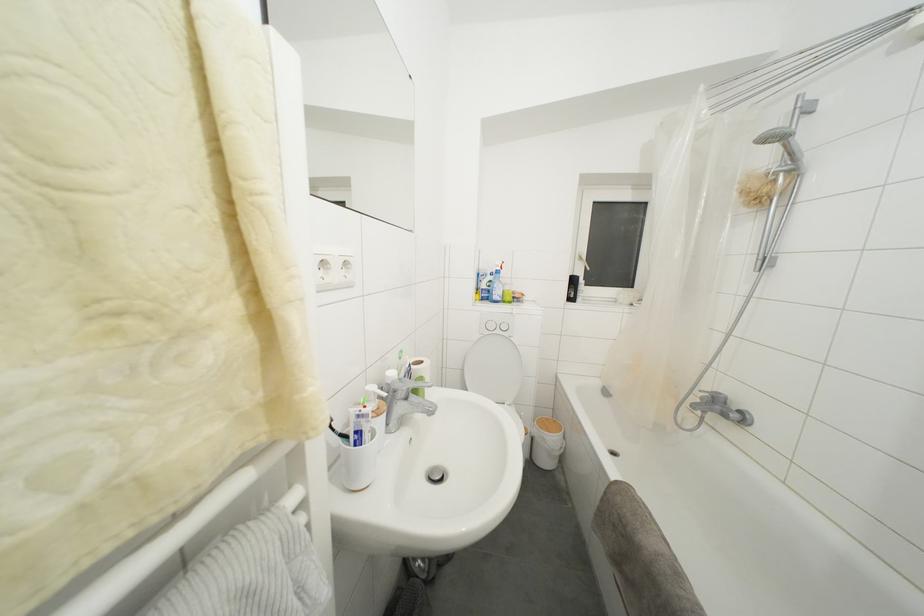
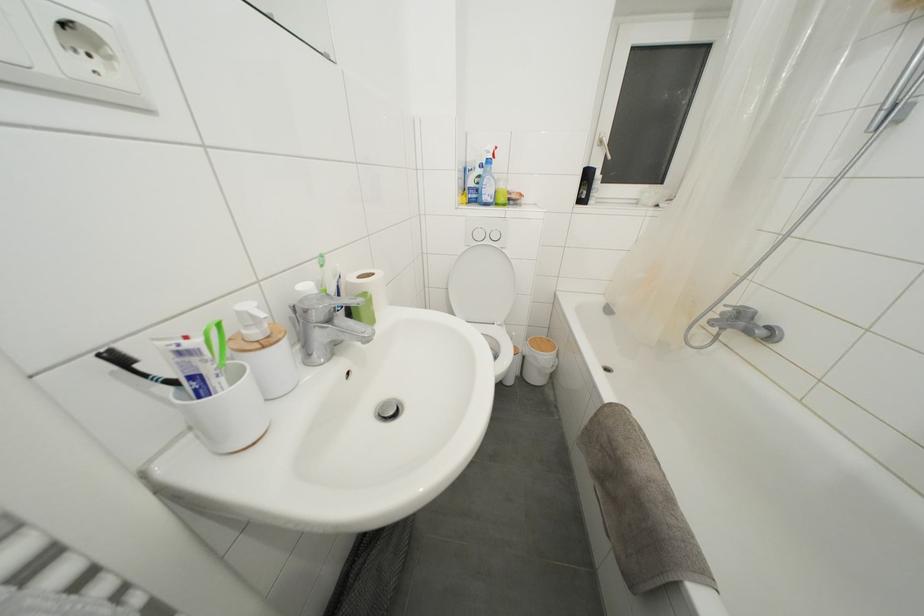
Locate, in the second image, the point that corresponds to point 585,264 in the first image.

(604, 148)